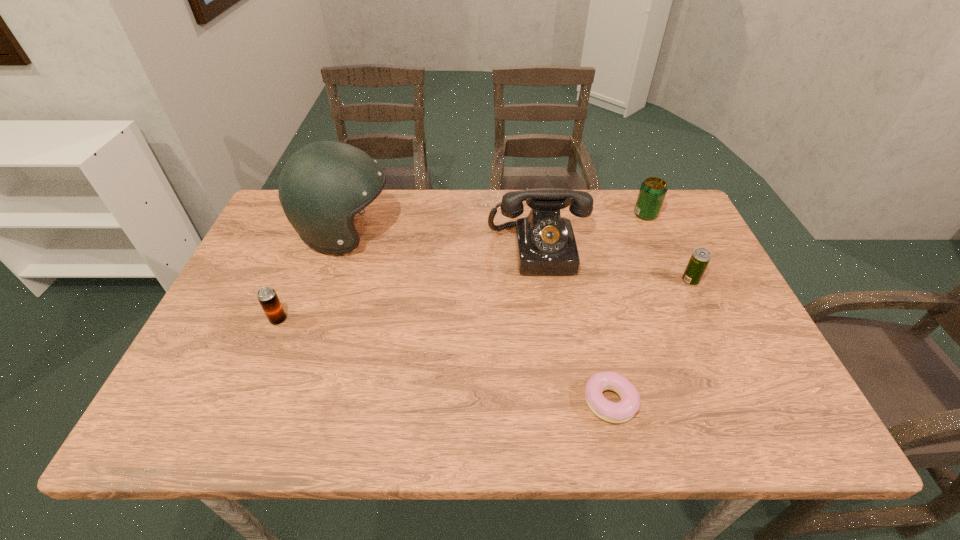
Image resolution: width=960 pixels, height=540 pixels. I want to click on object at the far left corner, so click(323, 185).

You are a GUI agent. You are given a task and a screenshot of the screen. Output one action in this format:
    pyautogui.click(x=<x>, y=<y>)
    Task: Click on the object located in the far right corner section of the desktop
    
    Given the screenshot: What is the action you would take?
    pyautogui.click(x=653, y=190)

I want to click on free space at the far edge of the desktop, so click(584, 190).

Identify the location of vacant space at the near edge of the desktop. (353, 434).

The width and height of the screenshot is (960, 540). I want to click on vacant point at the left edge, so click(256, 316).

The height and width of the screenshot is (540, 960). I want to click on vacant space at the right edge of the desktop, so click(660, 280).

Image resolution: width=960 pixels, height=540 pixels. What are the coordinates of `empty location between the tallest object and the second nearest object` in the screenshot? It's located at (312, 276).

You are a GUI agent. You are given a task and a screenshot of the screen. Output one action in this format:
    pyautogui.click(x=<x>, y=<y>)
    Task: Click on the free space between the fifth farthest object and the football helmet
    The width and height of the screenshot is (960, 540).
    Given the screenshot: What is the action you would take?
    pyautogui.click(x=312, y=276)

Find the location of a particular element. The height and width of the screenshot is (540, 960). free space between the fifth shortest object and the shortest object is located at coordinates pos(574,326).

Image resolution: width=960 pixels, height=540 pixels. What are the coordinates of `free space between the second nearest beer can and the fifth farthest object` in the screenshot? It's located at (484, 300).